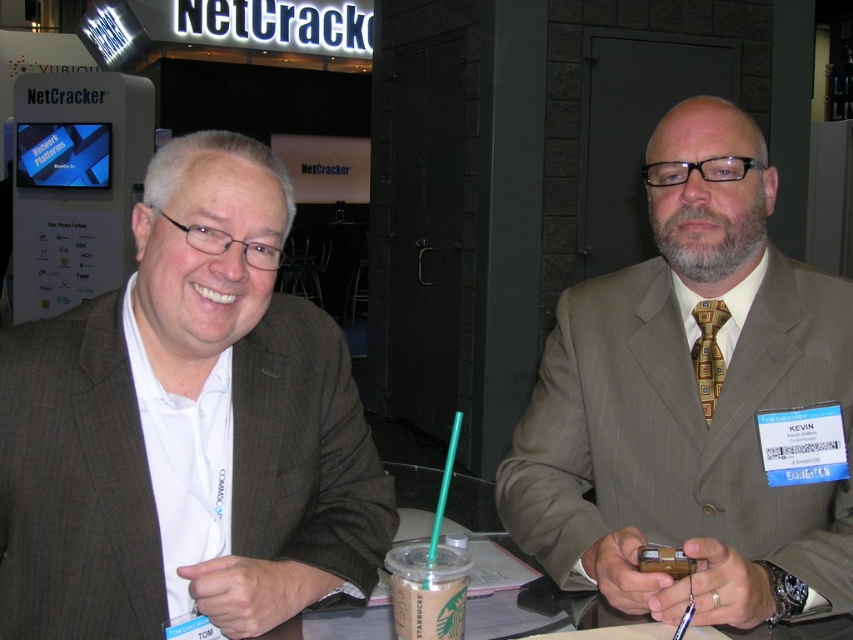
The image size is (853, 640). What do you see at coordinates (689, 401) in the screenshot? I see `matte gray suit at center` at bounding box center [689, 401].

How distant is matte gray suit at center from brown paper cup at center?

matte gray suit at center is 17.18 inches away from brown paper cup at center.

Is point (722, 410) closer to camera compared to point (428, 628)?

No, it is not.

In order to click on matte gray suit at center in this screenshot , I will do `click(689, 401)`.

Consider the image. Which is more to the right, matte brown suit at center or brown paper cup at center?

Positioned to the right is brown paper cup at center.

Does matte brown suit at center come behind brown paper cup at center?

That is True.

Does point (248, 145) come behind point (409, 604)?

Yes.

Locate an element on the screen. matte brown suit at center is located at coordinates (186, 428).

Measure the distance between matte brown suit at center and camera.

They are 31.71 inches apart.

Describe the element at coordinates (186, 428) in the screenshot. I see `matte brown suit at center` at that location.

Where is `matte brown suit at center`? The width and height of the screenshot is (853, 640). matte brown suit at center is located at coordinates (186, 428).